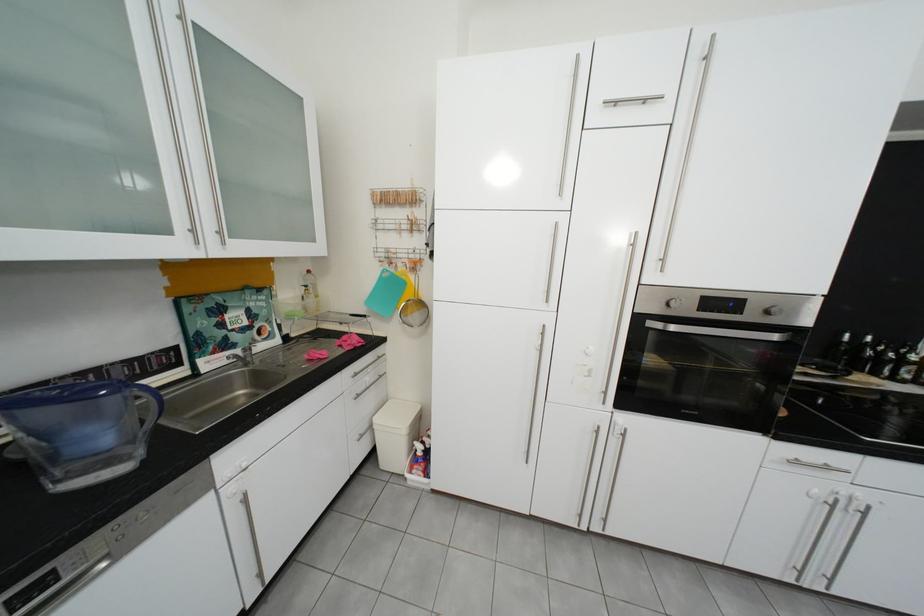
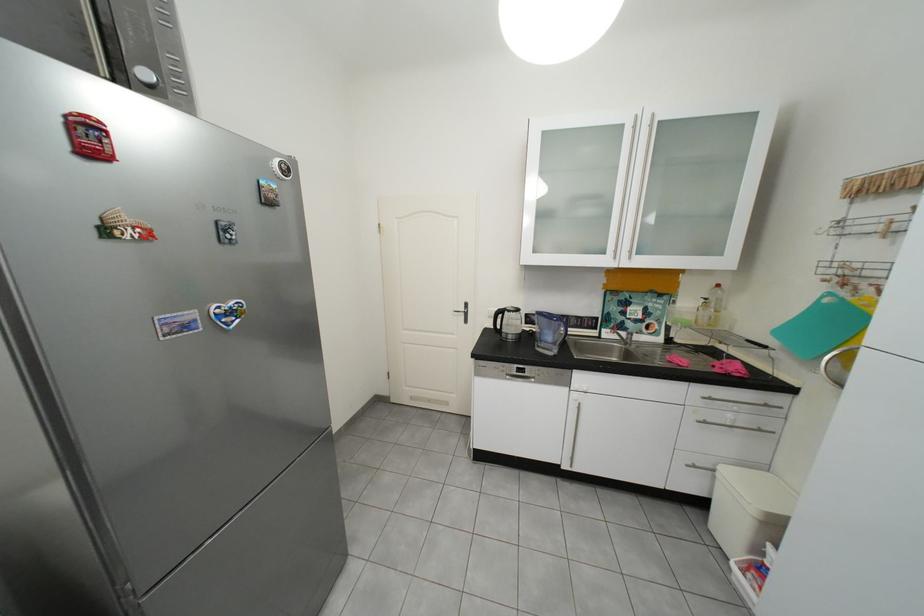
Locate, in the second image, the point that corresponds to [368,376] in the first image.

(723, 400)